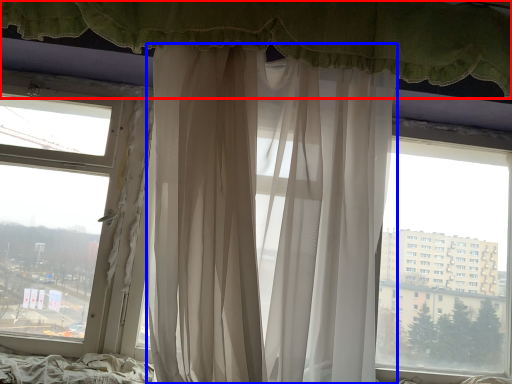
Question: Which of the following is the farthest to the observer, curtain (highlighted by a red box) or curtain (highlighted by a blue box)?

Choices:
 (A) curtain
 (B) curtain

Answer: (A)